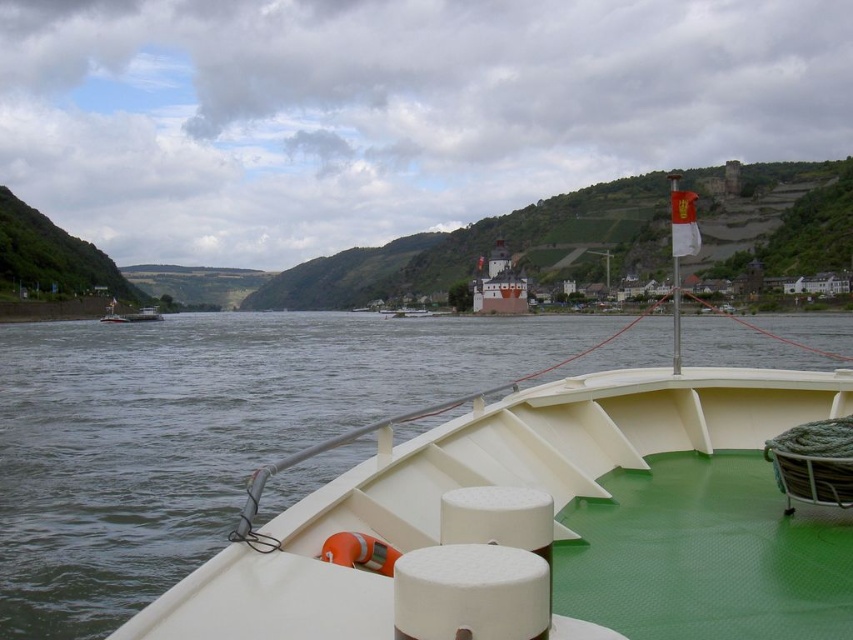
Question: Is green rubber water at center above white matte castle at center?

Choices:
 (A) yes
 (B) no

Answer: (B)

Question: Among these objects, which one is nearest to the camera?

Choices:
 (A) white matte castle at center
 (B) green rubber water at center

Answer: (B)

Question: Which of the following is the farthest from the observer?

Choices:
 (A) coord(25,445)
 (B) coord(502,244)

Answer: (B)

Question: Can you confirm if green rubber water at center is positioned to the right of white matte castle at center?

Choices:
 (A) no
 (B) yes

Answer: (A)

Question: Can you confirm if green rubber water at center is smaller than white matte castle at center?

Choices:
 (A) no
 (B) yes

Answer: (A)